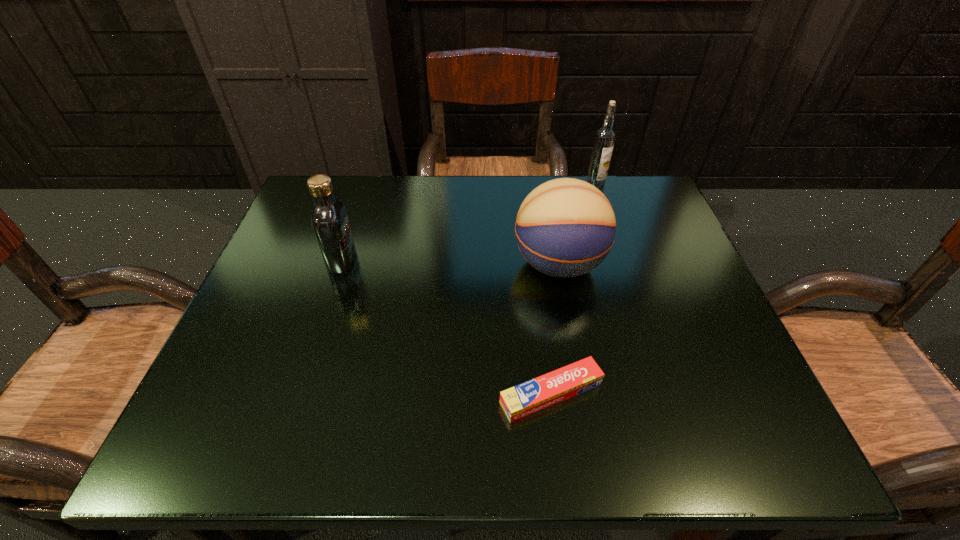
Find the location of a particular element. free location that satisfies the following two spatial constraints: 1. on the label of the farthest object; 2. on the front-facing side of the nearer vodka is located at coordinates (620, 260).